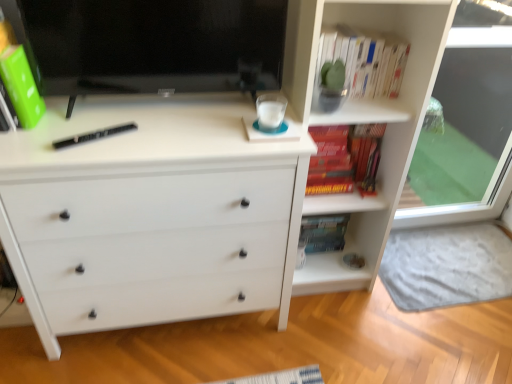
Locate an element on the screen. The image size is (512, 384). free space above white matte chest of drawers at center (from a real-world perspective) is located at coordinates (138, 122).